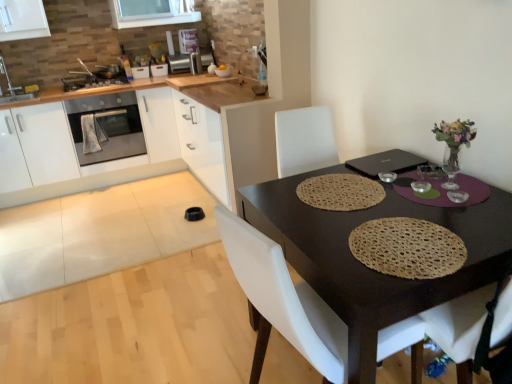
Question: Considering the relative sizes of metallic silver stove at upper left, the 4th appliance from the right, and woven beige placemat at table center in the image provided, is metallic silver stove at upper left, the 4th appliance from the right, shorter than woven beige placemat at table center?

Choices:
 (A) yes
 (B) no

Answer: (B)

Question: Considering the relative sizes of metallic silver stove at upper left, the 4th appliance from the right, and woven beige placemat at table center in the image provided, is metallic silver stove at upper left, the 4th appliance from the right, smaller than woven beige placemat at table center?

Choices:
 (A) no
 (B) yes

Answer: (A)

Question: Can you confirm if metallic silver stove at upper left, which appears as the 1th appliance when viewed from the left, is bigger than woven beige placemat at table center?

Choices:
 (A) no
 (B) yes

Answer: (B)

Question: Is metallic silver stove at upper left, which appears as the 1th appliance when viewed from the left, at the left side of woven beige placemat at table center?

Choices:
 (A) no
 (B) yes

Answer: (B)

Question: Is metallic silver stove at upper left, which appears as the 1th appliance when viewed from the left, far from woven beige placemat at table center?

Choices:
 (A) yes
 (B) no

Answer: (A)

Question: Considering the relative positions of satin silver toaster at upper center, the fourth appliance positioned from the left, and white glossy sink at upper left in the image provided, is satin silver toaster at upper center, the fourth appliance positioned from the left, to the left or to the right of white glossy sink at upper left?

Choices:
 (A) right
 (B) left

Answer: (A)

Question: Considering the positions of satin silver toaster at upper center, marked as the first appliance in a right-to-left arrangement, and white glossy sink at upper left in the image, is satin silver toaster at upper center, marked as the first appliance in a right-to-left arrangement, taller or shorter than white glossy sink at upper left?

Choices:
 (A) tall
 (B) short

Answer: (B)

Question: Considering the positions of point (193, 72) and point (1, 69), is point (193, 72) closer or farther from the camera than point (1, 69)?

Choices:
 (A) closer
 (B) farther

Answer: (B)

Question: Is satin silver toaster at upper center, marked as the first appliance in a right-to-left arrangement, in front of or behind white glossy sink at upper left in the image?

Choices:
 (A) front
 (B) behind

Answer: (B)

Question: Considering the positions of metallic silver stove at upper left, which appears as the 1th appliance when viewed from the left, and brown woven placemat at center in the image, is metallic silver stove at upper left, which appears as the 1th appliance when viewed from the left, taller or shorter than brown woven placemat at center?

Choices:
 (A) tall
 (B) short

Answer: (B)

Question: Based on their sizes in the image, would you say metallic silver stove at upper left, which appears as the 1th appliance when viewed from the left, is bigger or smaller than brown woven placemat at center?

Choices:
 (A) big
 (B) small

Answer: (B)

Question: In terms of width, does metallic silver stove at upper left, the 4th appliance from the right, look wider or thinner when compared to brown woven placemat at center?

Choices:
 (A) thin
 (B) wide

Answer: (A)

Question: Is point (79, 82) positioned closer to the camera than point (358, 266)?

Choices:
 (A) closer
 (B) farther

Answer: (B)

Question: From the image's perspective, is satin silver toaster at upper center, the fourth appliance positioned from the left, positioned above or below matte stainless steel oven at left?

Choices:
 (A) above
 (B) below

Answer: (A)

Question: Relative to matte stainless steel oven at left, is satin silver toaster at upper center, the fourth appliance positioned from the left, in front or behind?

Choices:
 (A) behind
 (B) front

Answer: (A)